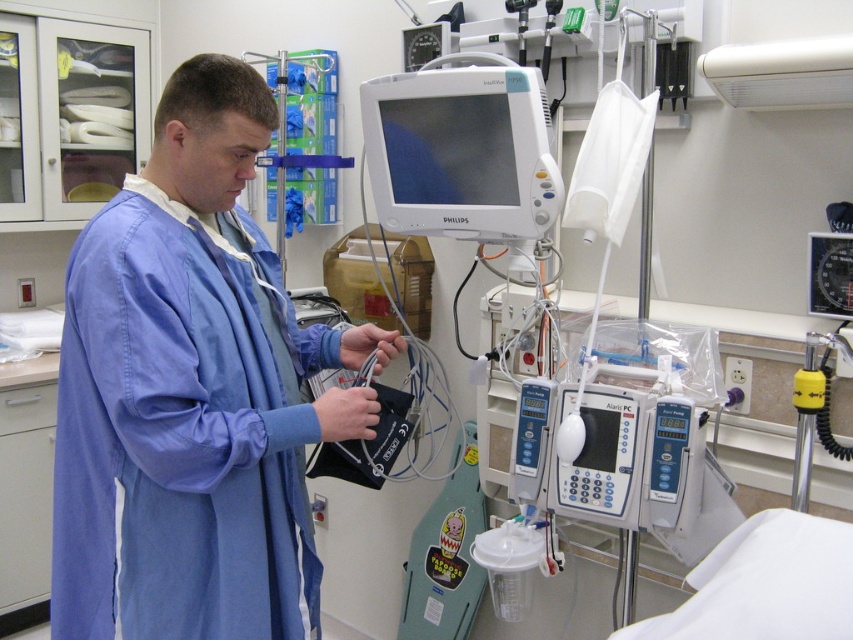
Measure the distance from blue cotton gown at center to green plastic bag at center.

1.01 meters

In the scene shown: Which is more to the left, blue cotton gown at center or green plastic bag at center?

blue cotton gown at center

Which is in front, point (209, 385) or point (474, 500)?

Point (209, 385) is more forward.

Locate an element on the screen. blue cotton gown at center is located at coordinates (180, 433).

Is blue cotton gown at center in front of white glossy monitor at center?

Yes, blue cotton gown at center is in front of white glossy monitor at center.

Is point (264, 525) in front of point (521, 145)?

Yes.

Is point (154, 547) in front of point (492, 93)?

Yes.

Locate an element on the screen. blue cotton gown at center is located at coordinates (180, 433).

Who is positioned more to the left, white glossy monitor at center or green plastic bag at center?

Positioned to the left is green plastic bag at center.

The image size is (853, 640). In order to click on white glossy monitor at center in this screenshot , I will do `click(461, 150)`.

The height and width of the screenshot is (640, 853). Find the location of `white glossy monitor at center`. white glossy monitor at center is located at coordinates (461, 150).